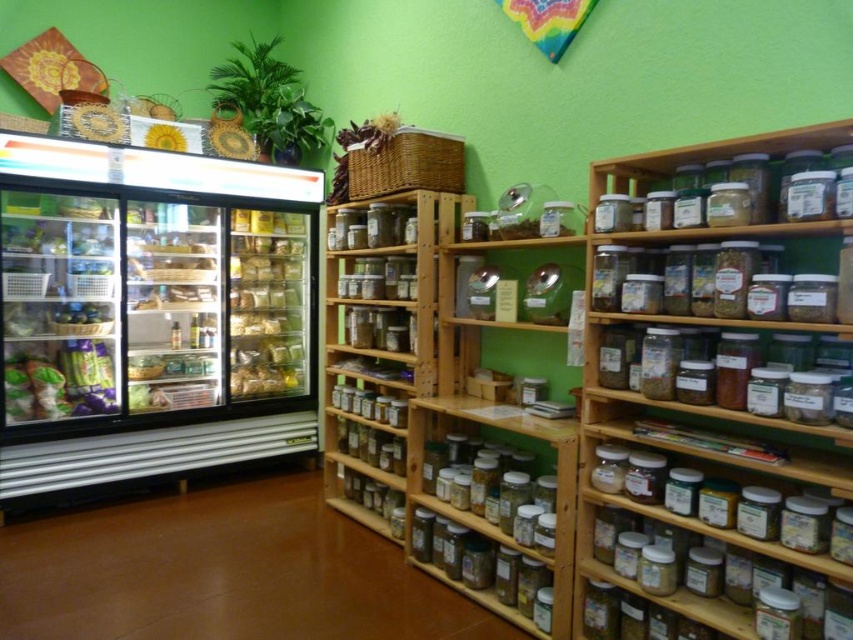
Is the position of clear plastic jars at upper right more distant than that of clear glass refrigerator at left?

No, clear plastic jars at upper right is closer to the viewer.

Between clear plastic jars at upper right and clear glass refrigerator at left, which one has less height?

Standing shorter between the two is clear plastic jars at upper right.

Which is in front, point (627, 324) or point (88, 323)?

Point (627, 324)

You are a GUI agent. You are given a task and a screenshot of the screen. Output one action in this format:
    pyautogui.click(x=<x>, y=<y>)
    Task: Click on the clear plastic jars at upper right
    
    Given the screenshot: What is the action you would take?
    pyautogui.click(x=718, y=403)

Who is shorter, clear plastic jars at upper right or translucent plastic bag at center?

With less height is translucent plastic bag at center.

Is point (827, 308) behind point (248, 250)?

No.

What do you see at coordinates (718, 403) in the screenshot? I see `clear plastic jars at upper right` at bounding box center [718, 403].

Identify the location of clear plastic jars at upper right. (718, 403).

Which is above, clear glass refrigerator at left or translucent plastic bag at center?

translucent plastic bag at center

Is clear glass refrigerator at left shorter than translucent plastic bag at center?

Incorrect, clear glass refrigerator at left's height does not fall short of translucent plastic bag at center's.

Image resolution: width=853 pixels, height=640 pixels. Describe the element at coordinates (149, 312) in the screenshot. I see `clear glass refrigerator at left` at that location.

I want to click on clear glass refrigerator at left, so click(x=149, y=312).